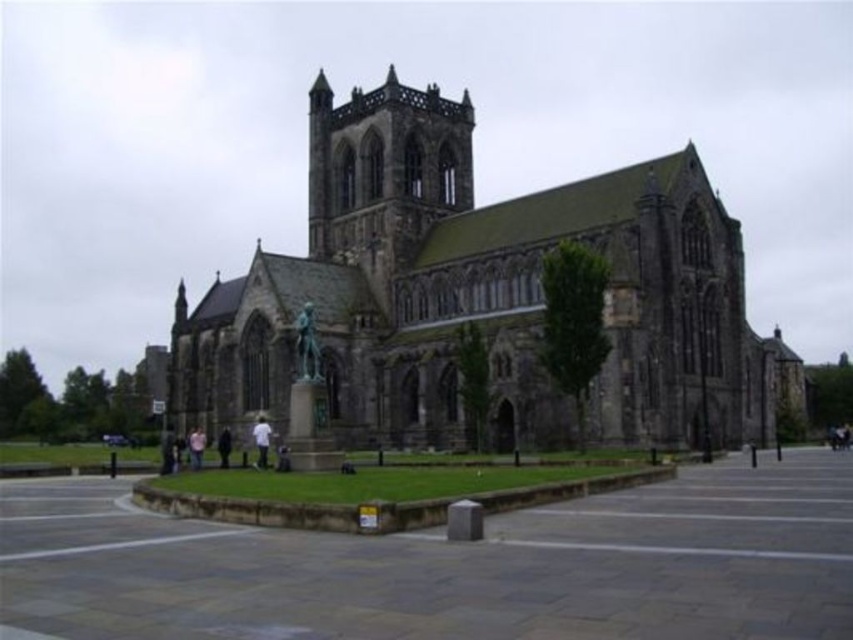
Can you confirm if smooth stone plaza at center is bigger than light brown leather jacket at lower left?

Indeed, smooth stone plaza at center has a larger size compared to light brown leather jacket at lower left.

Does smooth stone plaza at center lie in front of light brown leather jacket at lower left?

Yes, it is.

The width and height of the screenshot is (853, 640). Identify the location of smooth stone plaza at center. (448, 564).

Who is more forward, (91, 563) or (259, 440)?

Point (91, 563)

Is smooth stone plaza at center thinner than white fabric shirt at center?

In fact, smooth stone plaza at center might be wider than white fabric shirt at center.

This screenshot has width=853, height=640. In order to click on smooth stone plaza at center in this screenshot , I will do `click(448, 564)`.

Does point (302, 348) come closer to viewer compared to point (175, 460)?

Yes, point (302, 348) is closer to viewer.

You are a GUI agent. You are given a task and a screenshot of the screen. Output one action in this format:
    pyautogui.click(x=<x>, y=<y>)
    Task: Click on the bronze statue at center
    This screenshot has height=640, width=853.
    Given the screenshot: What is the action you would take?
    pyautogui.click(x=306, y=344)